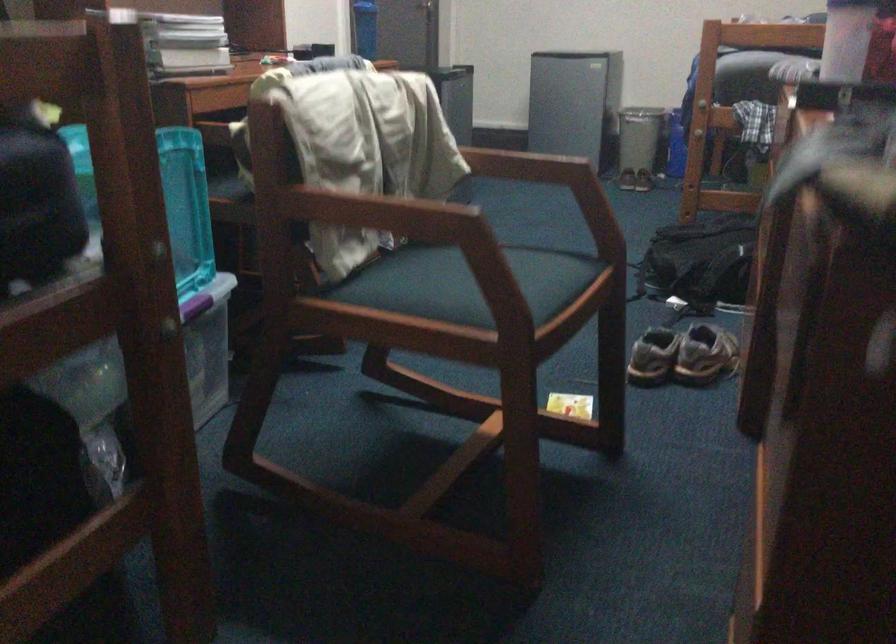
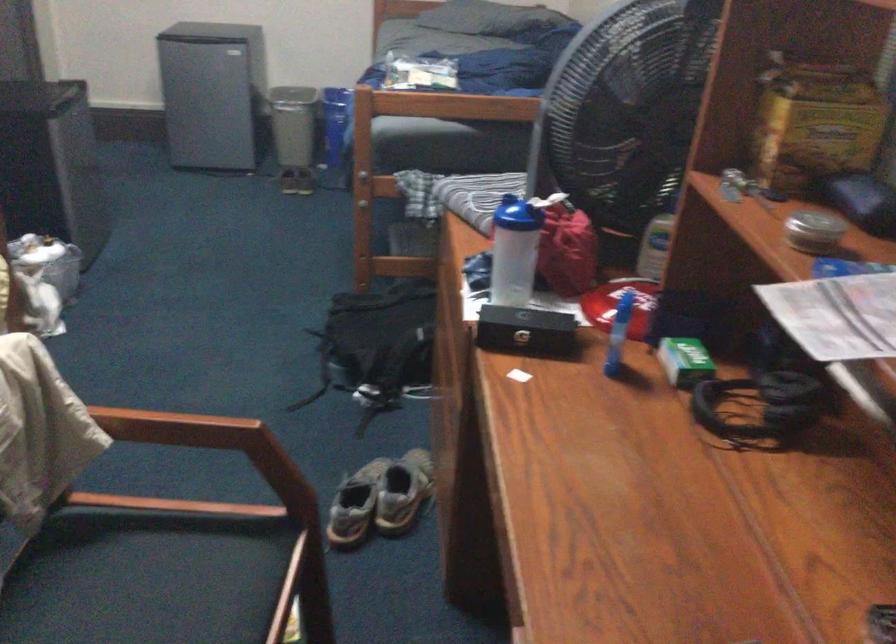
Locate, in the second image, the point that corresponds to point (708, 355) in the first image.

(402, 491)